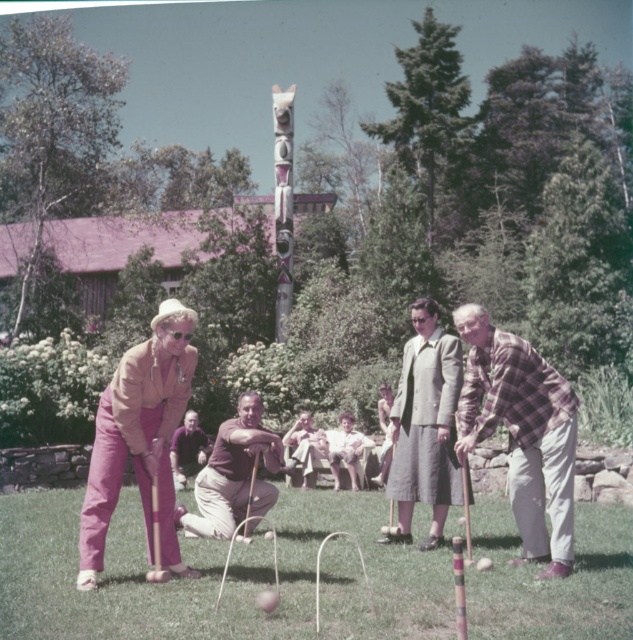
You are a photographer trying to capture a closeup of the matte pink pants at center and the brown cotton shirt at center. Which object should you zoom in on to ensure it takes up more space in your photo?

The matte pink pants at center is larger in size than the brown cotton shirt at center, so you should zoom in on the matte pink pants at center to ensure it takes up more space in your photo.

You are a photographer positioned at the edge of the croquet lawn. You want to take a photo that includes both the brown cotton shirt at center and the carved wood totem pole at center. Based on their positions, which object should you adjust your camera to focus on first to ensure both are in the frame?

The brown cotton shirt at center is to the right of the carved wood totem pole at center. To include both in the frame, focus on the carved wood totem pole at center first since it is on the left side, then adjust to ensure the brown cotton shirt at center on the right is also visible.